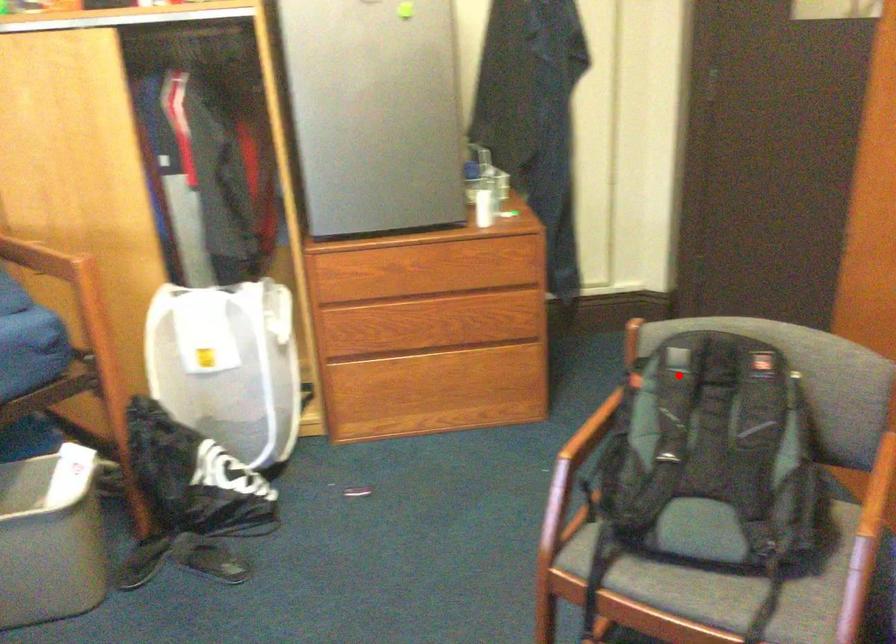
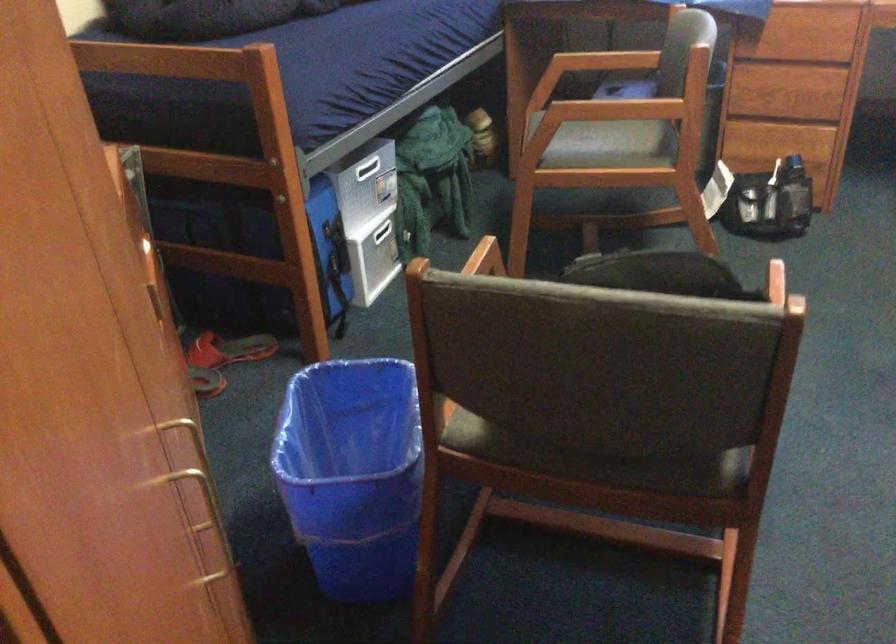
The point at the highlighted location is marked in the first image. Where is the corresponding point in the second image?

(659, 272)